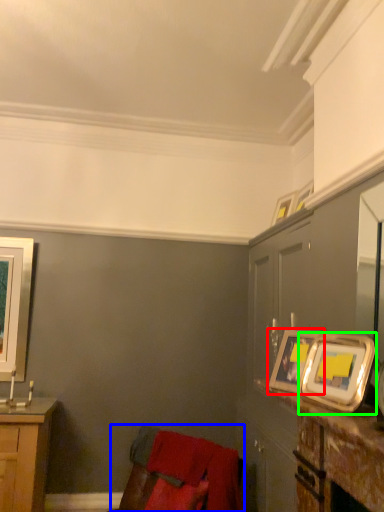
Question: Estimate the real-world distances between objects in this image. Which object is closer to picture frame (highlighted by a red box), swivel chair (highlighted by a blue box) or picture frame (highlighted by a green box)?

Choices:
 (A) swivel chair
 (B) picture frame

Answer: (B)